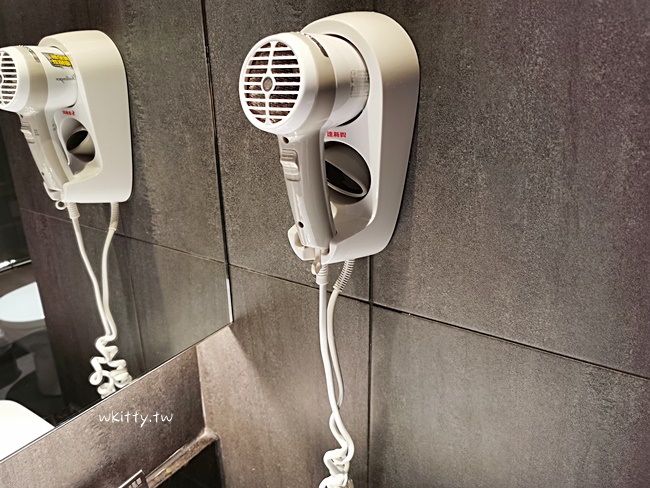
At what (x,y) coordinates should I click in order to perform the action: click on electrical cord. Please return your answer as a coordinate pair (x, y). This screenshot has width=650, height=488. Looking at the image, I should click on (326, 324).